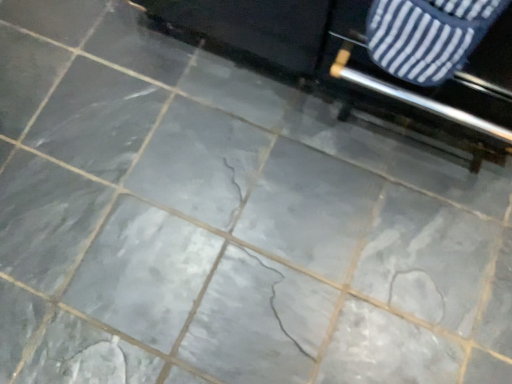
Describe the element at coordinates (443, 84) in the screenshot. I see `striped fabric cushion at upper right` at that location.

Where is `striped fabric cushion at upper right`? The image size is (512, 384). striped fabric cushion at upper right is located at coordinates (443, 84).

This screenshot has width=512, height=384. Identify the location of striped fabric cushion at upper right. (443, 84).